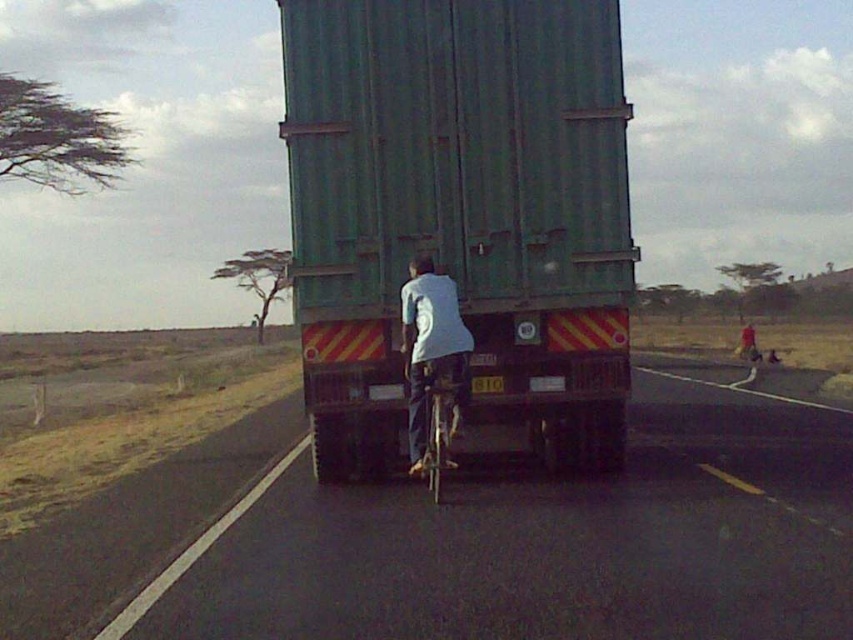
Question: Among these points, which one is nearest to the camera?

Choices:
 (A) (410, 400)
 (B) (440, 369)
 (C) (245, 605)
 (D) (387, 109)

Answer: (C)

Question: Can you confirm if black asphalt road at center is thinner than metallic silver bicycle at center?

Choices:
 (A) yes
 (B) no

Answer: (B)

Question: Which object is positioned farthest from the green matte trailer truck at center?

Choices:
 (A) white matte shirt at center
 (B) metallic silver bicycle at center

Answer: (B)

Question: Is black asphalt road at center smaller than white matte shirt at center?

Choices:
 (A) no
 (B) yes

Answer: (A)

Question: Is black asphalt road at center positioned before white matte shirt at center?

Choices:
 (A) no
 (B) yes

Answer: (B)

Question: Which point is farther to the camera?

Choices:
 (A) (434, 445)
 (B) (305, 636)
 (C) (434, 314)
 (D) (564, 301)

Answer: (D)